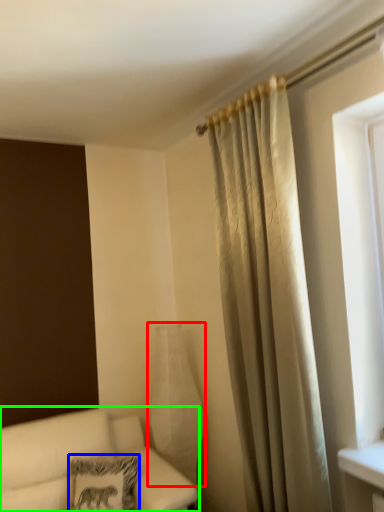
Question: Estimate the real-world distances between objects in this image. Which object is farther from glass vase (highlighted by a red box), pillow (highlighted by a blue box) or studio couch (highlighted by a green box)?

Choices:
 (A) pillow
 (B) studio couch

Answer: (A)